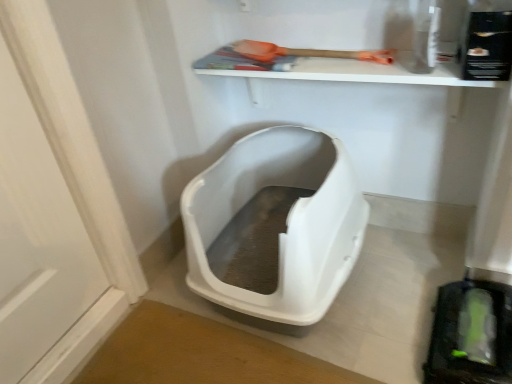
Question: From a real-world perspective, is orange plastic shovel at upper center positioned above or below white plastic litter box at center?

Choices:
 (A) below
 (B) above

Answer: (B)

Question: Is orange plastic shovel at upper center wider or thinner than white plastic litter box at center?

Choices:
 (A) thin
 (B) wide

Answer: (A)

Question: Considering their positions, is orange plastic shovel at upper center located in front of or behind white plastic litter box at center?

Choices:
 (A) behind
 (B) front

Answer: (A)

Question: Is point (239, 165) closer or farther from the camera than point (253, 46)?

Choices:
 (A) closer
 (B) farther

Answer: (B)

Question: Considering the relative positions of white plastic litter box at center and orange plastic shovel at upper center in the image provided, is white plastic litter box at center to the left or to the right of orange plastic shovel at upper center?

Choices:
 (A) right
 (B) left

Answer: (B)

Question: Do you think white plastic litter box at center is within orange plastic shovel at upper center, or outside of it?

Choices:
 (A) outside
 (B) inside

Answer: (A)

Question: From a real-world perspective, is white plastic litter box at center above or below orange plastic shovel at upper center?

Choices:
 (A) above
 (B) below

Answer: (B)